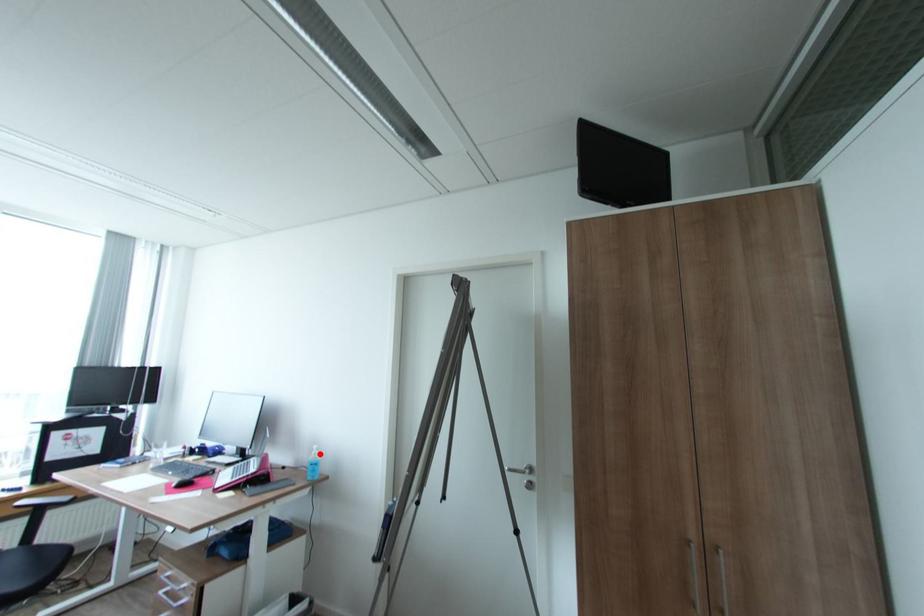
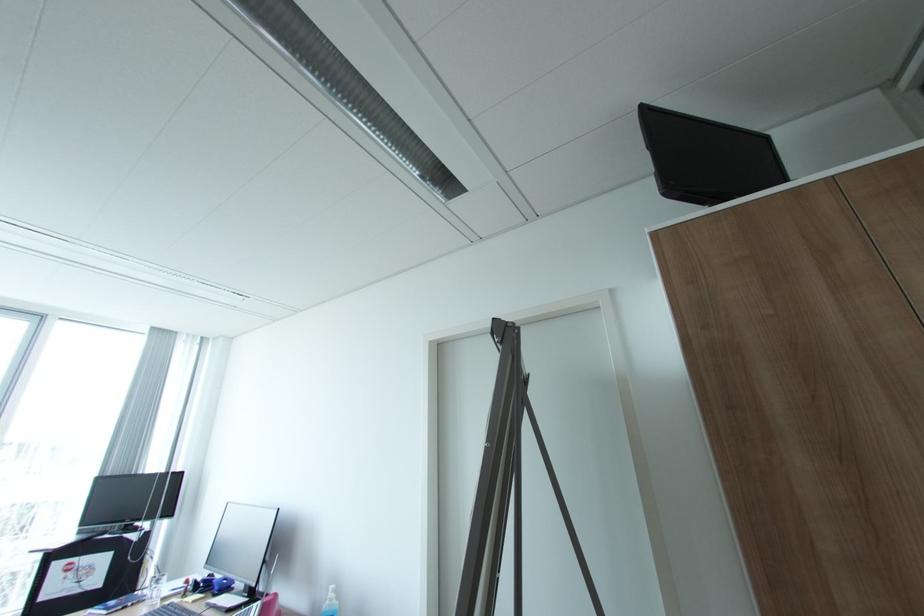
Locate, in the second image, the point that corresponds to the highlighted location in the first image.

(336, 599)